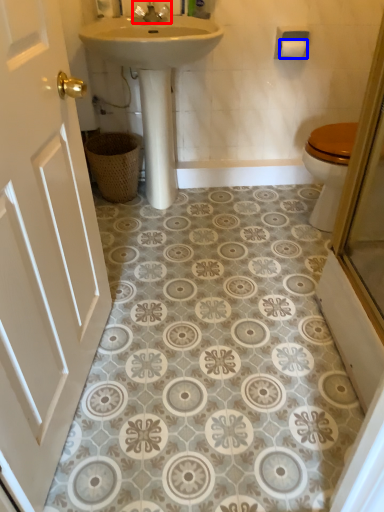
Question: Which object is further to the camera taking this photo, tap (highlighted by a red box) or toilet paper (highlighted by a blue box)?

Choices:
 (A) tap
 (B) toilet paper

Answer: (B)